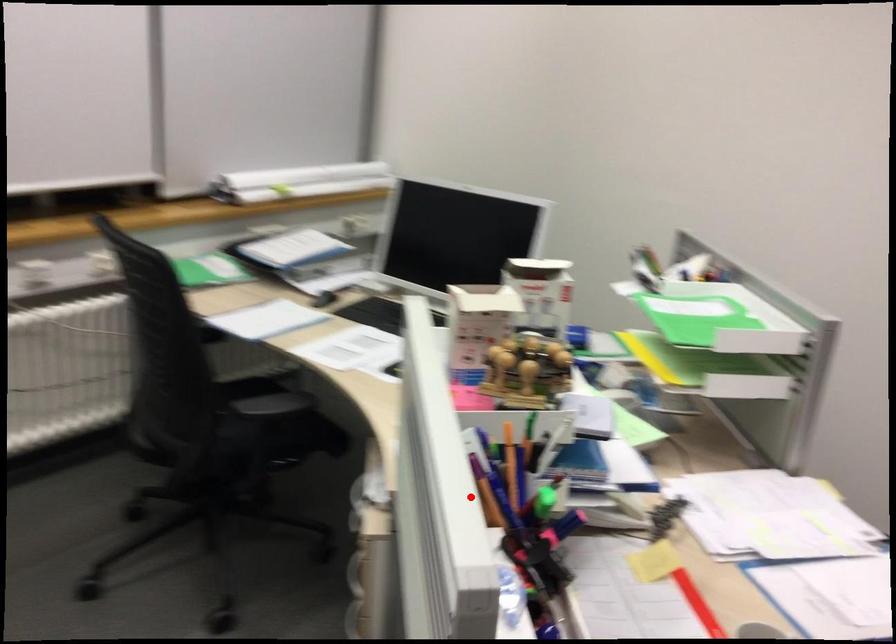
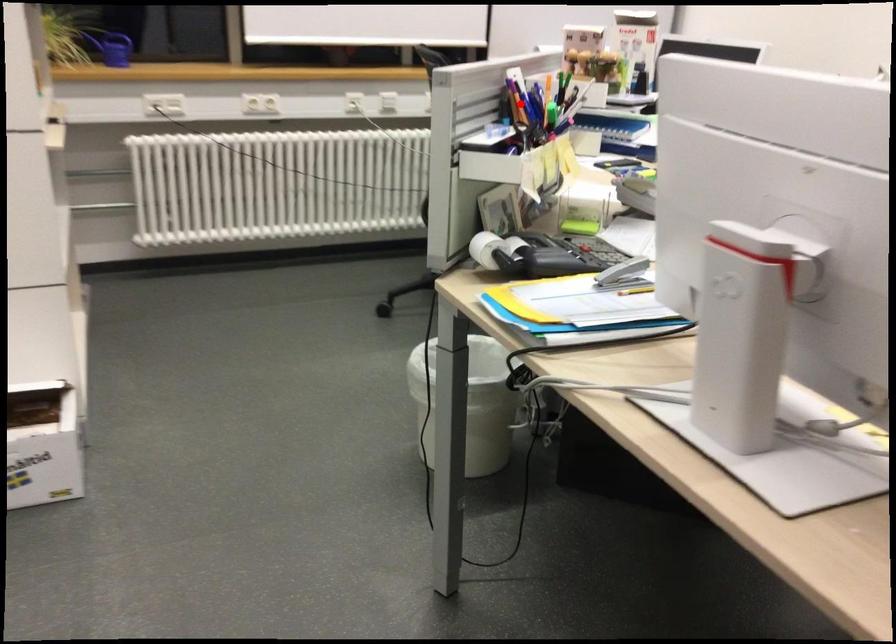
I am providing you with two images of the same scene from different viewpoints. A red point is marked on the first image and another point is marked on the second image. Does the point marked in image1 correspond to the same location as the one in image2?

Yes